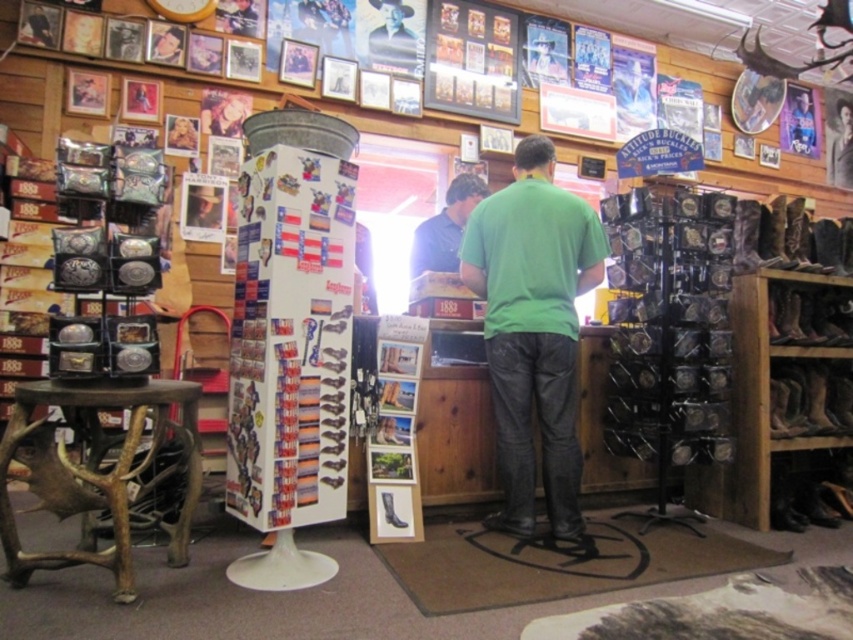
You are a customer in the store and want to place the rugged leather cowboy hat at upper center on the brown wooden stool at lower left. Is the stool large enough to hold the hat?

The brown wooden stool at lower left has a larger size compared to rugged leather cowboy hat at upper center, so yes, the stool is large enough to hold the hat.

You are a customer in the store and want to place a small gift on the green matte shirt at center and the brown wooden stool at lower left. Which object can the gift be placed on without it falling off?

The green matte shirt at center is taller than the brown wooden stool at lower left, so the gift can be placed on the brown wooden stool at lower left without it falling off since it has a stable surface.

Based on the photo, you are a customer in the store and want to place a hat on the green matte shirt at center and the brown wooden stool at lower left. Which object should you place the hat on if you want it closer to the right side of the store?

The green matte shirt at center is positioned on the right side of brown wooden stool at lower left, so placing the hat on the green matte shirt at center would position it closer to the right side of the store.